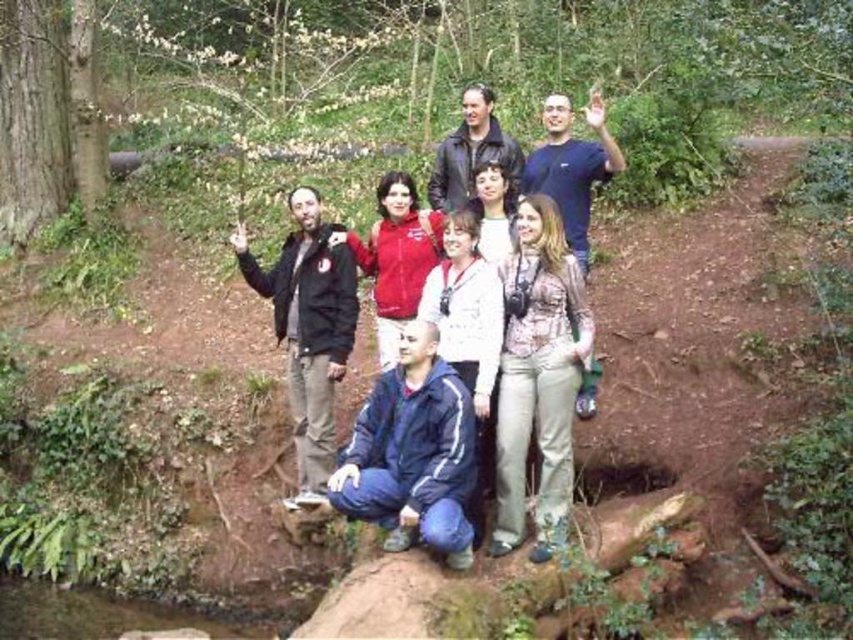
You are standing in the forest scene and want to find the blue fabric jacket at center. Which direction should you look relative to the black matte jacket at left?

The blue fabric jacket at center is to the right of the black matte jacket at left, so you should look to the right side of the black matte jacket at left to find it.

You are a photographer trying to capture a clear shot of both the patterned fabric blouse at center and the blue fabric jacket at center in the scene. Since you want to ensure both are visible, which clothing item should you focus on first to ensure it doesn

The patterned fabric blouse at center is larger in size compared to the blue fabric jacket at center, so you should focus on capturing the patterned fabric blouse at center first to ensure its details are clear before adjusting for the smaller blue fabric jacket at center.

You are a photographer standing at the edge of the rocky outcrop. You want to take a photo that includes both the blue fabric jacket at center and the black matte jacket at left. Given that your camera has a maximum focus range of 1.2 meters, will you be able to capture both jackets in focus without moving your position?

The blue fabric jacket at center and the black matte jacket at left are 1.28 meters apart from each other. Since the distance between them exceeds the camera maximum focus range of 1.2 meters, you will not be able to capture both jackets in focus without moving your position.